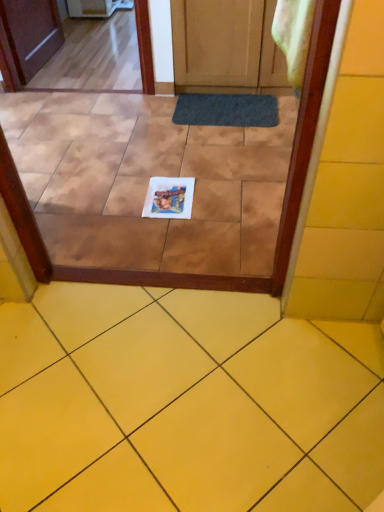
Find the location of a particular element. This screenshot has width=384, height=512. free spot in front of white glossy coaster at center is located at coordinates (170, 233).